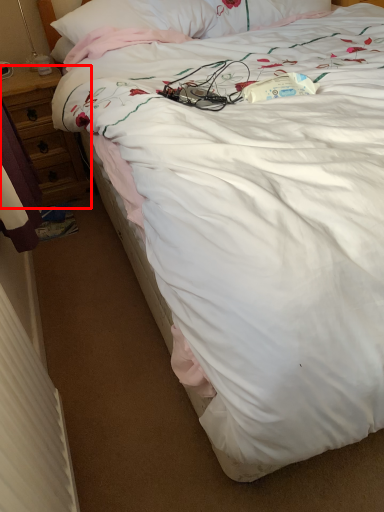
Question: From the image's perspective, where is desk (annotated by the red box) located in relation to radiator in the image?

Choices:
 (A) above
 (B) below

Answer: (A)